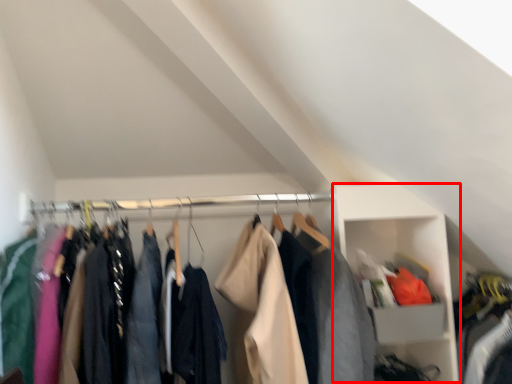
Question: From the image's perspective, what is the correct spatial positioning of cabinet (annotated by the red box) in reference to clothing?

Choices:
 (A) above
 (B) below

Answer: (B)